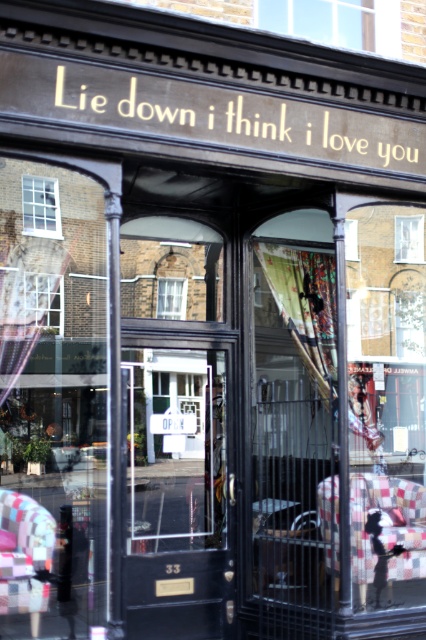
Is clear glass window at upper left taller than clear glass window at center?

Yes, clear glass window at upper left is taller than clear glass window at center.

Does clear glass window at upper left have a lesser width compared to clear glass window at center?

No.

Who is more forward, (32, 316) or (169, 305)?

Positioned in front is point (32, 316).

You are a GUI agent. You are given a task and a screenshot of the screen. Output one action in this format:
    pyautogui.click(x=<x>, y=<y>)
    Task: Click on the clear glass window at upper left
    The height and width of the screenshot is (640, 426).
    Given the screenshot: What is the action you would take?
    (43, 300)

Between white glass window at upper left and clear glass window at upper left, which one appears on the left side from the viewer's perspective?

From the viewer's perspective, white glass window at upper left appears more on the left side.

How much distance is there between white glass window at upper left and clear glass window at upper left?

white glass window at upper left and clear glass window at upper left are 19.70 inches apart.

Identify the location of white glass window at upper left. (40, 205).

Which is above, clear glass window at upper left or transparent glass window at center?

transparent glass window at center is above.

Does clear glass window at upper left have a greater height compared to transparent glass window at center?

Yes, clear glass window at upper left is taller than transparent glass window at center.

The width and height of the screenshot is (426, 640). Describe the element at coordinates (43, 300) in the screenshot. I see `clear glass window at upper left` at that location.

At what (x,y) coordinates should I click in order to perform the action: click on clear glass window at upper left. Please return your answer as a coordinate pair (x, y). The width and height of the screenshot is (426, 640). Looking at the image, I should click on (43, 300).